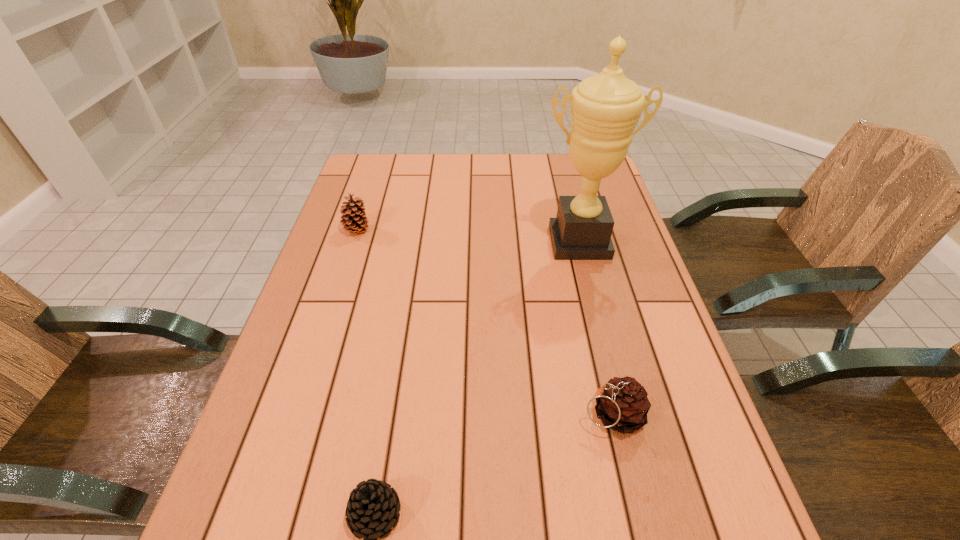
Identify the location of trophy cup. The image size is (960, 540). (605, 108).

Identify the location of the farthest pinecone. (355, 221).

Find the location of a particular element. This screenshot has width=960, height=540. the leftmost object is located at coordinates (355, 221).

I want to click on the second farthest pinecone, so click(x=622, y=405).

You are a GUI agent. You are given a task and a screenshot of the screen. Output one action in this format:
    pyautogui.click(x=<x>, y=<y>)
    Task: Click on the second nearest object
    This screenshot has height=540, width=960.
    Given the screenshot: What is the action you would take?
    pyautogui.click(x=622, y=405)

The image size is (960, 540). Find the location of `free space located at the front of the trophy cup with handles`. free space located at the front of the trophy cup with handles is located at coordinates (606, 349).

You are a GUI agent. You are given a task and a screenshot of the screen. Output one action in this format:
    pyautogui.click(x=<x>, y=<y>)
    Task: Click on the vacant region located on the back of the farthest pinecone
    The width and height of the screenshot is (960, 540).
    Given the screenshot: What is the action you would take?
    [378, 166]

The image size is (960, 540). Identify the location of vacant point located 0.150m with a leaf charm attached to the rightmost pinecone. (502, 414).

Where is `free location located with a leaf charm attached to the rightmost pinecone`? free location located with a leaf charm attached to the rightmost pinecone is located at coordinates (549, 414).

Locate an element on the screen. This screenshot has height=540, width=960. vacant area located 0.150m with a leaf charm attached to the rightmost pinecone is located at coordinates (502, 414).